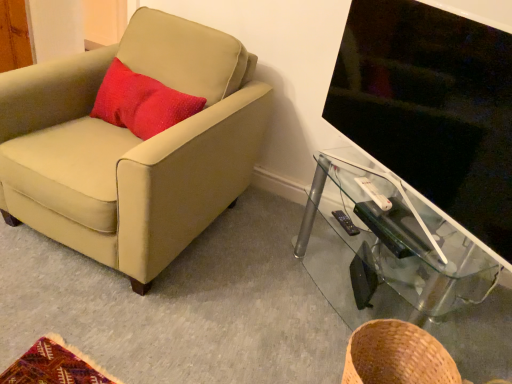
Describe the element at coordinates (431, 108) in the screenshot. I see `black glossy tv at right` at that location.

This screenshot has width=512, height=384. I want to click on black plastic remote control at lower right, positioned as the second remote control in top-to-bottom order, so click(346, 223).

Measure the distance between transparent glass tv stand at right and camera.

The distance of transparent glass tv stand at right from camera is 1.21 meters.

In order to click on brown woven basket at lower right in this screenshot , I will do `click(397, 356)`.

Find the location of a particular element. beige fabric chair at left is located at coordinates (131, 146).

Is point (372, 195) less distant than point (488, 69)?

No, it is behind (488, 69).

Is white plastic remote control at right, the second remote control ordered from the bottom, at the left side of black glossy tv at right?

Indeed, white plastic remote control at right, the second remote control ordered from the bottom, is positioned on the left side of black glossy tv at right.

From a real-world perspective, is white plastic remote control at right, the second remote control ordered from the bottom, physically above black glossy tv at right?

No, from a real-world perspective, white plastic remote control at right, the second remote control ordered from the bottom, is not over black glossy tv at right

Is transparent glass tv stand at right oriented towards brown woven basket at lower right?

No, transparent glass tv stand at right is not oriented towards brown woven basket at lower right.

From the image's perspective, is transparent glass tv stand at right positioned above or below brown woven basket at lower right?

Based on their image positions, transparent glass tv stand at right is located above brown woven basket at lower right.

From the picture: Is transparent glass tv stand at right spatially inside brown woven basket at lower right, or outside of it?

transparent glass tv stand at right is spatially situated outside brown woven basket at lower right.

What's the angular difference between transparent glass tv stand at right and brown woven basket at lower right's facing directions?

60.8 degrees.

At what (x,y) coordinates should I click in order to perform the action: click on basket below the black glossy tv at right (from the image's perspective). Please return your answer as a coordinate pair (x, y). The image size is (512, 384). Looking at the image, I should click on (397, 356).

How distant is brown woven basket at lower right from black glossy tv at right?

A distance of 23.27 inches exists between brown woven basket at lower right and black glossy tv at right.

Does brown woven basket at lower right have a greater height compared to black glossy tv at right?

No.

Considering the sizes of transparent glass tv stand at right and white plastic remote control at right, which ranks as the first remote control in front-to-back order, in the image, is transparent glass tv stand at right taller or shorter than white plastic remote control at right, which ranks as the first remote control in front-to-back order,?

In the image, transparent glass tv stand at right appears to be taller than white plastic remote control at right, which ranks as the first remote control in front-to-back order.

How far apart are transparent glass tv stand at right and white plastic remote control at right, marked as the second remote control in a back-to-front arrangement?

They are 12.79 inches apart.

This screenshot has width=512, height=384. I want to click on desk located below the white plastic remote control at right, the second remote control ordered from the bottom (from the image's perspective), so click(x=401, y=263).

From the picture: From a real-world perspective, which is physically above, transparent glass tv stand at right or white plastic remote control at right, positioned as the first remote control in top-to-bottom order?

white plastic remote control at right, positioned as the first remote control in top-to-bottom order.

Is beige fabric chair at left not close to white plastic remote control at right, the second remote control ordered from the bottom?

No, beige fabric chair at left is not far away from white plastic remote control at right, the second remote control ordered from the bottom.

Does beige fabric chair at left have a lesser height compared to white plastic remote control at right, positioned as the first remote control in top-to-bottom order?

No, beige fabric chair at left is not shorter than white plastic remote control at right, positioned as the first remote control in top-to-bottom order.

Would you say white plastic remote control at right, which ranks as the first remote control in front-to-back order, is part of beige fabric chair at left's contents?

Definitely not — white plastic remote control at right, which ranks as the first remote control in front-to-back order, is not inside beige fabric chair at left.

The width and height of the screenshot is (512, 384). I want to click on desk located below the beige fabric chair at left (from the image's perspective), so click(x=401, y=263).

Is beige fabric chair at left behind transparent glass tv stand at right?

No.

From a real-world perspective, is beige fabric chair at left over transparent glass tv stand at right?

Yes, from a real-world perspective, beige fabric chair at left is above transparent glass tv stand at right.

Is black glossy tv at right shorter than brown woven basket at lower right?

No, black glossy tv at right is not shorter than brown woven basket at lower right.

Considering the sizes of black glossy tv at right and brown woven basket at lower right in the image, is black glossy tv at right bigger or smaller than brown woven basket at lower right?

black glossy tv at right is bigger than brown woven basket at lower right.

Considering the positions of objects black glossy tv at right and brown woven basket at lower right in the image provided, who is more to the right, black glossy tv at right or brown woven basket at lower right?

Positioned to the right is black glossy tv at right.

Where is `television to the right of white plastic remote control at right, which ranks as the first remote control in front-to-back order`? television to the right of white plastic remote control at right, which ranks as the first remote control in front-to-back order is located at coordinates (431, 108).

Locate an element on the screen. basket below the transparent glass tv stand at right (from a real-world perspective) is located at coordinates (397, 356).

Which object lies further to the anchor point black glossy tv at right, transparent glass tv stand at right or black plastic remote control at lower right, arranged as the 1th remote control when viewed from the back?

black plastic remote control at lower right, arranged as the 1th remote control when viewed from the back.

Which object lies further to the anchor point black glossy tv at right, beige fabric chair at left or white plastic remote control at right, which ranks as the first remote control in front-to-back order?

Based on the image, beige fabric chair at left appears to be further to black glossy tv at right.

Estimate the real-world distances between objects in this image. Which object is closer to black plastic remote control at lower right, which is the 2th remote control from front to back, brown woven basket at lower right or white plastic remote control at right, marked as the second remote control in a back-to-front arrangement?

white plastic remote control at right, marked as the second remote control in a back-to-front arrangement, lies closer to black plastic remote control at lower right, which is the 2th remote control from front to back, than the other object.

Which object lies nearer to the anchor point beige fabric chair at left, transparent glass tv stand at right or black plastic remote control at lower right, which is the 2th remote control from front to back?

transparent glass tv stand at right lies closer to beige fabric chair at left than the other object.

When comparing their distances from transparent glass tv stand at right, does black plastic remote control at lower right, arranged as the 1th remote control when viewed from the back, or brown woven basket at lower right seem closer?

Among the two, black plastic remote control at lower right, arranged as the 1th remote control when viewed from the back, is located nearer to transparent glass tv stand at right.

Looking at this image, when comparing their distances from beige fabric chair at left, does white plastic remote control at right, which ranks as the first remote control in front-to-back order, or black glossy tv at right seem closer?

→ black glossy tv at right is positioned closer to the anchor beige fabric chair at left.

Based on the photo, looking at the image, which one is located closer to beige fabric chair at left, black glossy tv at right or transparent glass tv stand at right?

The object closer to beige fabric chair at left is black glossy tv at right.

Which object lies nearer to the anchor point beige fabric chair at left, brown woven basket at lower right or black plastic remote control at lower right, arranged as the 1th remote control when viewed from the back?

black plastic remote control at lower right, arranged as the 1th remote control when viewed from the back.

Where is `remote control situated between beige fabric chair at left and white plastic remote control at right, marked as the second remote control in a back-to-front arrangement, from left to right`? remote control situated between beige fabric chair at left and white plastic remote control at right, marked as the second remote control in a back-to-front arrangement, from left to right is located at coordinates (346, 223).

Identify the location of remote control between beige fabric chair at left and brown woven basket at lower right in the horizontal direction. (346, 223).

Locate an element on the screen. The height and width of the screenshot is (384, 512). desk that lies between white plastic remote control at right, which ranks as the first remote control in front-to-back order, and brown woven basket at lower right from top to bottom is located at coordinates (401, 263).

Identify the location of remote control between black glossy tv at right and black plastic remote control at lower right, which is the 2th remote control from front to back, in the front-back direction. (x=374, y=193).